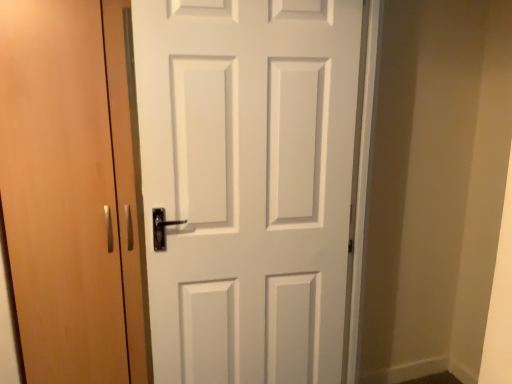
Question: Would you say light brown wood door at left, which appears as the 1th door when viewed from the left, is inside or outside white matte door at center, which ranks as the 2th door in left-to-right order?

Choices:
 (A) outside
 (B) inside

Answer: (A)

Question: From the image's perspective, is light brown wood door at left, which appears as the 1th door when viewed from the left, positioned above or below white matte door at center, the 1th door in the right-to-left sequence?

Choices:
 (A) below
 (B) above

Answer: (B)

Question: Is light brown wood door at left, the second door when ordered from right to left, bigger or smaller than white matte door at center, the 1th door in the right-to-left sequence?

Choices:
 (A) big
 (B) small

Answer: (A)

Question: Which is correct: white matte door at center, which ranks as the 2th door in left-to-right order, is inside light brown wood door at left, which appears as the 1th door when viewed from the left, or outside of it?

Choices:
 (A) outside
 (B) inside

Answer: (A)

Question: Is white matte door at center, the 1th door in the right-to-left sequence, to the left or to the right of light brown wood door at left, which appears as the 1th door when viewed from the left, in the image?

Choices:
 (A) left
 (B) right

Answer: (B)

Question: From the image's perspective, is white matte door at center, which ranks as the 2th door in left-to-right order, positioned above or below light brown wood door at left, the second door when ordered from right to left?

Choices:
 (A) below
 (B) above

Answer: (A)

Question: From a real-world perspective, is white matte door at center, which ranks as the 2th door in left-to-right order, physically located above or below light brown wood door at left, which appears as the 1th door when viewed from the left?

Choices:
 (A) below
 (B) above

Answer: (B)